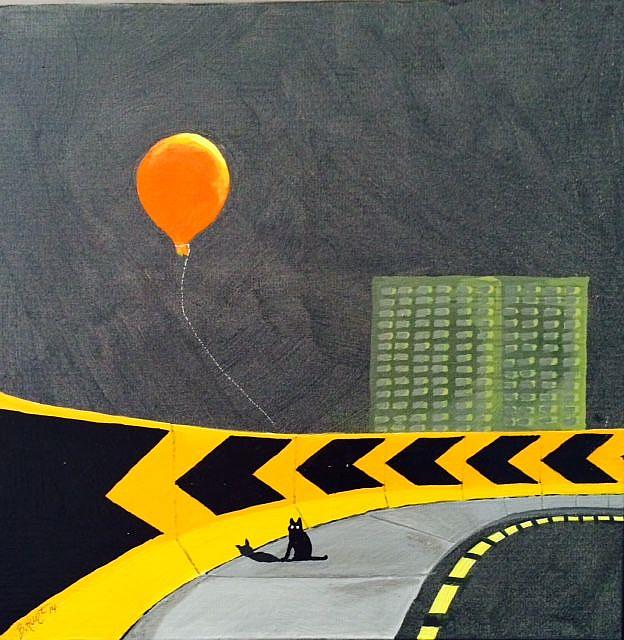
The height and width of the screenshot is (640, 624). Identify the location of black arrows on wall. (232, 467), (334, 468), (422, 466), (499, 460), (587, 459), (46, 505).